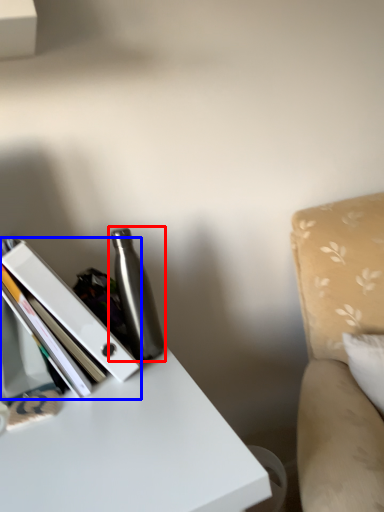
Question: Which point is further to the camera, bottle (highlighted by a red box) or book (highlighted by a blue box)?

Choices:
 (A) bottle
 (B) book

Answer: (A)